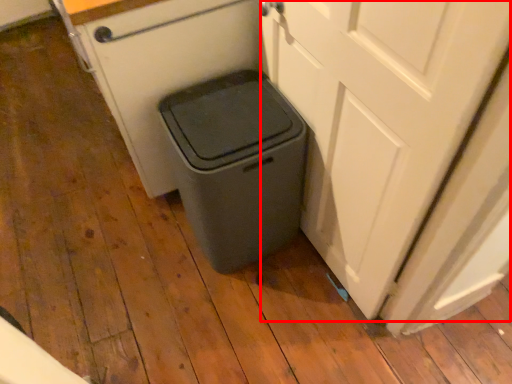
Question: From the image's perspective, what is the correct spatial relationship of screen door (annotated by the red box) in relation to waste container?

Choices:
 (A) below
 (B) above

Answer: (B)